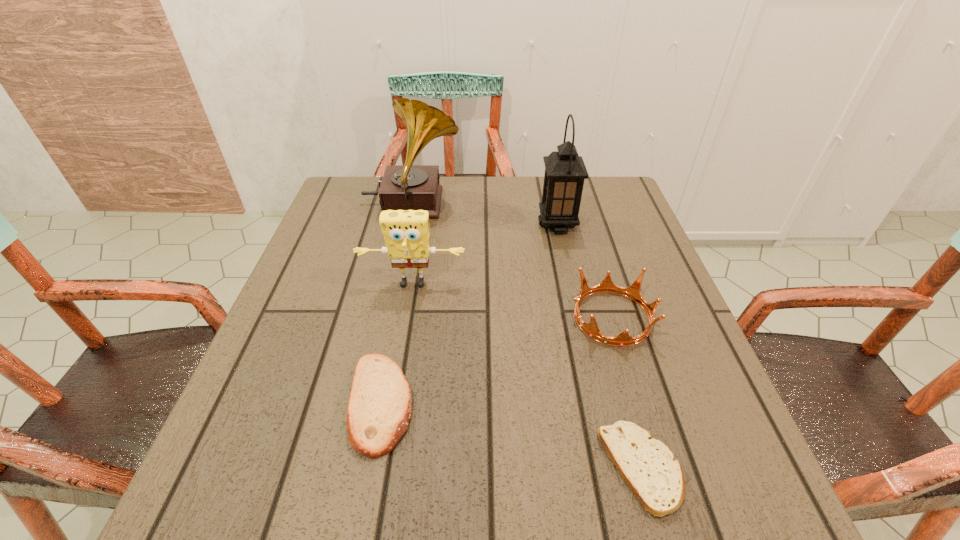
Find the location of a particular element. vacant area that satisfies the following two spatial constraints: 1. from the horn of the phonograph record; 2. on the left side of the lantern is located at coordinates [x=408, y=225].

This screenshot has width=960, height=540. Find the location of `free space that satisfies the following two spatial constraints: 1. from the horn of the phonograph record; 2. on the back side of the lantern`. free space that satisfies the following two spatial constraints: 1. from the horn of the phonograph record; 2. on the back side of the lantern is located at coordinates (408, 225).

I want to click on free spot that satisfies the following two spatial constraints: 1. from the horn of the taller pita bread; 2. on the left side of the phonograph record, so click(x=371, y=403).